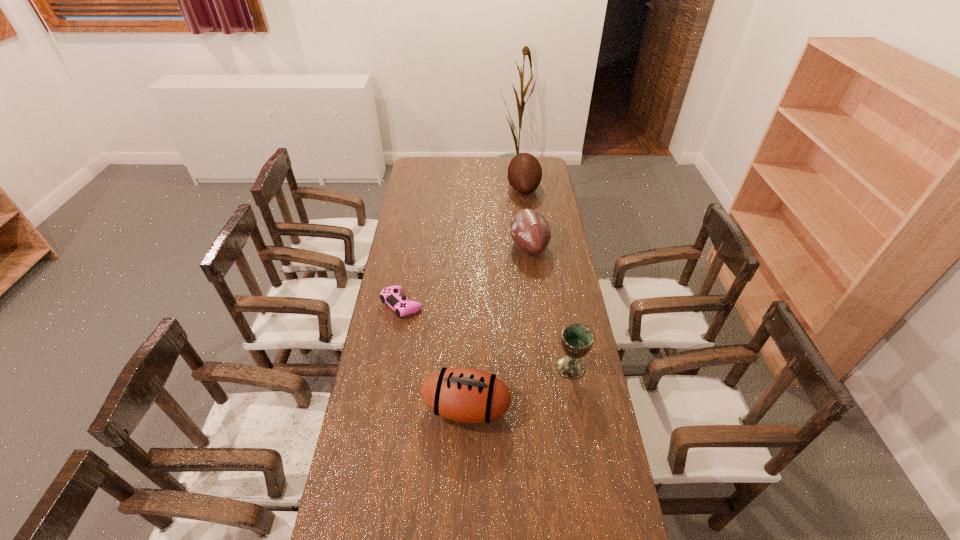
At what (x,y) coordinates should I click in order to perform the action: click on the farthest object. Please return your answer as a coordinate pair (x, y). Looking at the image, I should click on (524, 174).

At what (x,y) coordinates should I click in order to perform the action: click on the second farthest object. Please return your answer as a coordinate pair (x, y). Looking at the image, I should click on (530, 231).

The image size is (960, 540). I want to click on chalice, so click(577, 340).

I want to click on the nearest object, so click(x=467, y=395).

Image resolution: width=960 pixels, height=540 pixels. Find the location of `the leftmost football (American)`. the leftmost football (American) is located at coordinates (467, 395).

Locate an element on the screen. the leftmost object is located at coordinates (391, 295).

In order to click on the shortest object in this screenshot , I will do `click(391, 295)`.

The image size is (960, 540). Find the location of `free space located 0.200m on the laces of the farthest object`. free space located 0.200m on the laces of the farthest object is located at coordinates (469, 188).

You are a GUI agent. You are given a task and a screenshot of the screen. Output one action in this format:
    pyautogui.click(x=<x>, y=<y>)
    Task: Click on the free space located 0.310m on the laces of the farthest object
    The height and width of the screenshot is (540, 960).
    Given the screenshot: What is the action you would take?
    pyautogui.click(x=448, y=188)

The image size is (960, 540). I want to click on free location located on the laces of the farthest object, so click(439, 188).